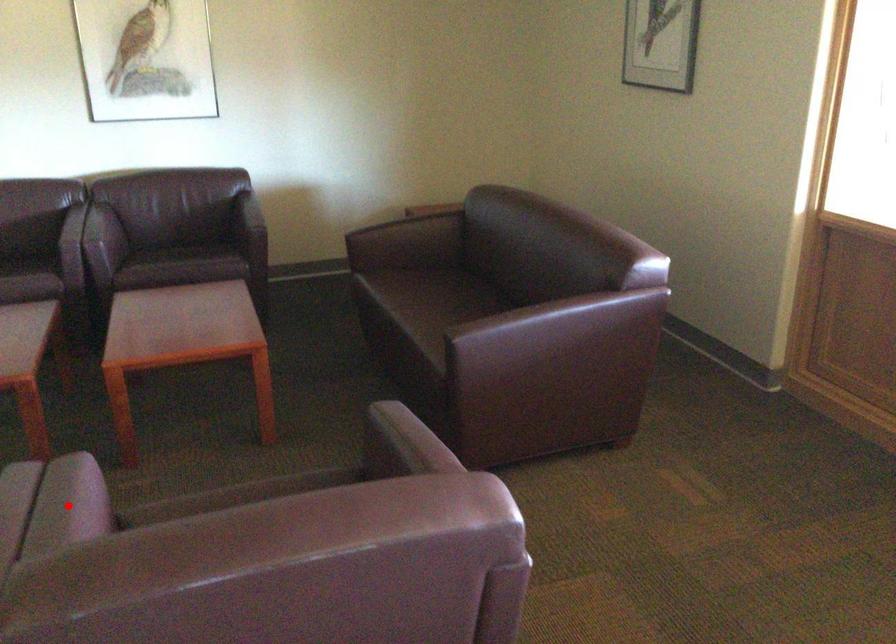
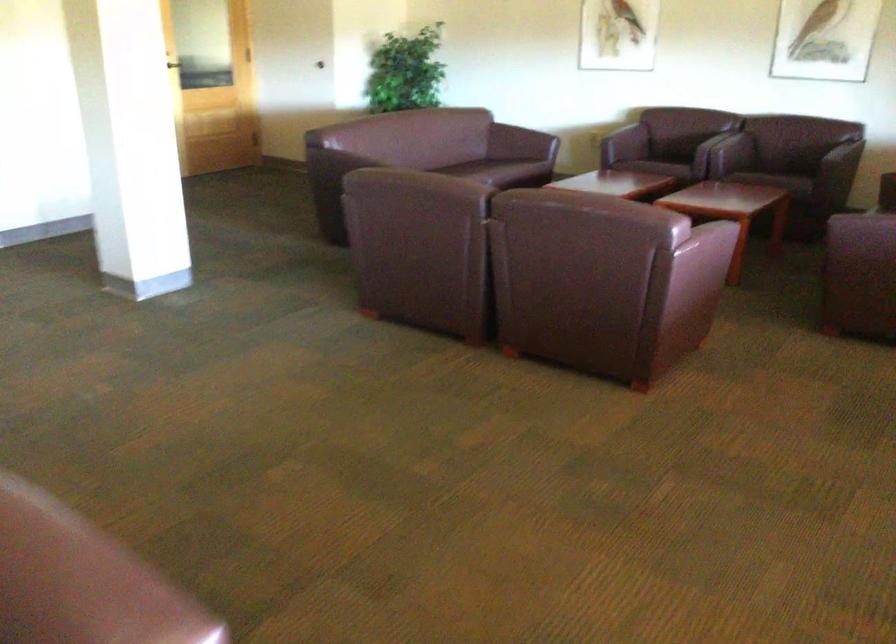
Question: I am providing you with two images of the same scene from different viewpoints. A red point is marked on the first image. Can you still see the location of the red point in image 2?

Choices:
 (A) Yes
 (B) No

Answer: (B)